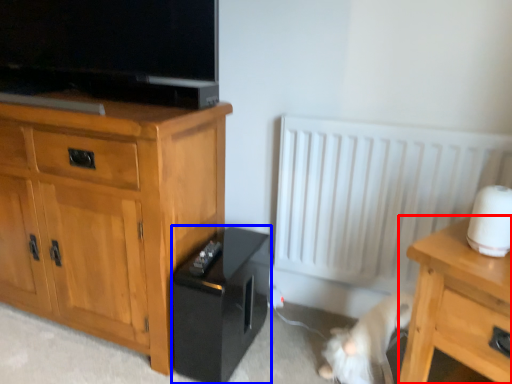
Question: Which object is further to the camera taking this photo, nightstand (highlighted by a red box) or amplifier (highlighted by a blue box)?

Choices:
 (A) nightstand
 (B) amplifier

Answer: (B)